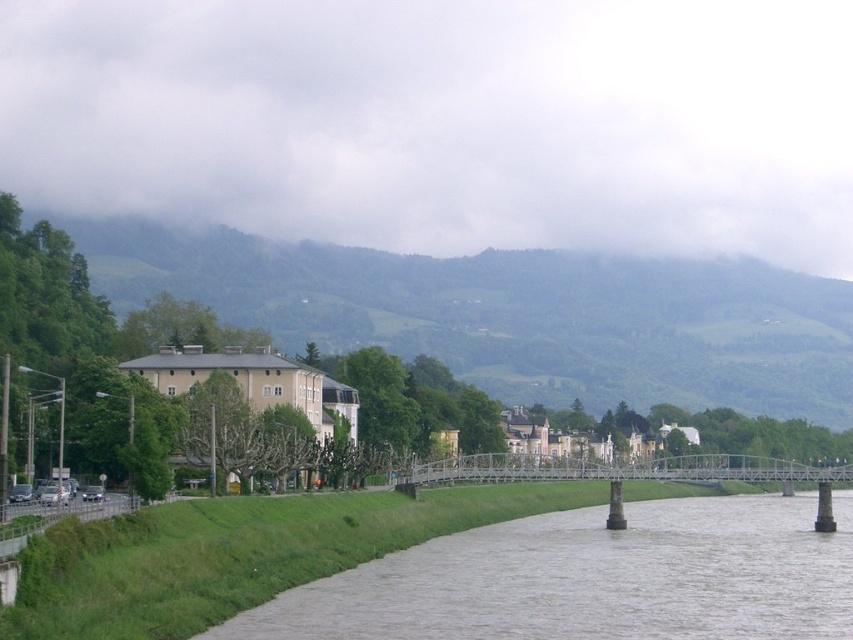
Looking at this image, which is more to the right, gray concrete river at lower center or white metal bridge at center?

Positioned to the right is white metal bridge at center.

Can you confirm if gray concrete river at lower center is smaller than white metal bridge at center?

Indeed, gray concrete river at lower center has a smaller size compared to white metal bridge at center.

The width and height of the screenshot is (853, 640). Find the location of `gray concrete river at lower center`. gray concrete river at lower center is located at coordinates (590, 579).